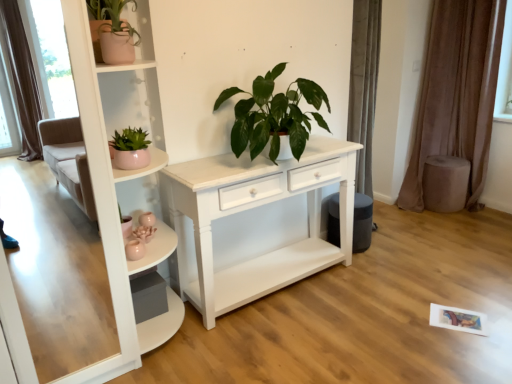
The image size is (512, 384). I want to click on matte pink pot at left, which is the 2th houseplant from left to right, so click(x=130, y=149).

This screenshot has height=384, width=512. What do you see at coordinates (457, 93) in the screenshot?
I see `brown velvet curtain at right` at bounding box center [457, 93].

Locate an element on the screen. This screenshot has height=384, width=512. green glossy plant at center, marked as the first houseplant in a right-to-left arrangement is located at coordinates pos(274,115).

Choose the correct answer: Is white glossy shelf at upper left inside matte pink pot at left, the 2th houseplant viewed from the right, or outside it?

white glossy shelf at upper left is located beyond the bounds of matte pink pot at left, the 2th houseplant viewed from the right.

From the white glossy shelf at upper left, count 1st houseplant to the right and point to it. Please provide its 2D coordinates.

[(130, 149)]

From a real-world perspective, which is physically above, white glossy shelf at upper left or matte pink pot at left, which is the 2th houseplant from left to right?

In real-world perspective, matte pink pot at left, which is the 2th houseplant from left to right, is above.

Measure the distance from white glossy shelf at upper left to matte pink pot at left, the 2th houseplant viewed from the right.

The distance of white glossy shelf at upper left from matte pink pot at left, the 2th houseplant viewed from the right, is 12.35 inches.

Locate an element on the screen. This screenshot has height=384, width=512. houseplant lying on the left of matte pink pot at left, which is the 2th houseplant from left to right is located at coordinates 112,32.

Between pink ceramic pot at upper left, the first houseplant positioned from the left, and matte pink pot at left, the 2th houseplant viewed from the right, which one appears on the right side from the viewer's perspective?

Positioned to the right is matte pink pot at left, the 2th houseplant viewed from the right.

Which point is more distant from viewer, [126,27] or [132,135]?

Positioned behind is point [132,135].

Does pink ceramic pot at upper left, which ranks as the 3th houseplant in right-to-left order, have a greater width compared to matte pink pot at left, the 2th houseplant viewed from the right?

Yes, pink ceramic pot at upper left, which ranks as the 3th houseplant in right-to-left order, is wider than matte pink pot at left, the 2th houseplant viewed from the right.

From the image's perspective, between matte pink pot at left, the 2th houseplant viewed from the right, and pink ceramic pot at upper left, which ranks as the 3th houseplant in right-to-left order, who is located below?

matte pink pot at left, the 2th houseplant viewed from the right.

Is matte pink pot at left, the 2th houseplant viewed from the right, in contact with pink ceramic pot at upper left, the first houseplant positioned from the left?

No, matte pink pot at left, the 2th houseplant viewed from the right, is not touching pink ceramic pot at upper left, the first houseplant positioned from the left.

Can you tell me how much matte pink pot at left, which is the 2th houseplant from left to right, and pink ceramic pot at upper left, the first houseplant positioned from the left, differ in facing direction?

There is a 11.9-degree angle between the facing directions of matte pink pot at left, which is the 2th houseplant from left to right, and pink ceramic pot at upper left, the first houseplant positioned from the left.

Is point (139, 159) closer or farther from the camera than point (104, 56)?

Clearly, point (139, 159) is more distant from the camera than point (104, 56).

Measure the distance from brown velvet curtain at right to white glossy shelf at upper left.

brown velvet curtain at right and white glossy shelf at upper left are 2.72 meters apart.

Is brown velvet curtain at right shorter than white glossy shelf at upper left?

Incorrect, the height of brown velvet curtain at right does not fall short of that of white glossy shelf at upper left.

Is brown velvet curtain at right turned away from white glossy shelf at upper left?

brown velvet curtain at right does not have its back to white glossy shelf at upper left.

From the image's perspective, between brown velvet curtain at right and white glossy shelf at upper left, who is located below?

white glossy shelf at upper left, from the image's perspective.

Which is more to the right, brown velvet curtain at right or matte pink pot at left, the 2th houseplant viewed from the right?

From the viewer's perspective, brown velvet curtain at right appears more on the right side.

Looking at the image, does brown velvet curtain at right seem bigger or smaller compared to matte pink pot at left, which is the 2th houseplant from left to right?

Clearly, brown velvet curtain at right is larger in size than matte pink pot at left, which is the 2th houseplant from left to right.

From the image's perspective, between brown velvet curtain at right and matte pink pot at left, the 2th houseplant viewed from the right, which one is located above?

brown velvet curtain at right is shown above in the image.

Which object is positioned more to the left, matte pink pot at left, the 2th houseplant viewed from the right, or green glossy plant at center, marked as the first houseplant in a right-to-left arrangement?

matte pink pot at left, the 2th houseplant viewed from the right, is more to the left.

Does point (113, 141) come closer to viewer compared to point (223, 95)?

That is True.

Considering the relative sizes of green glossy plant at center, acting as the third houseplant starting from the left, and white glossy shelf at upper left in the image provided, is green glossy plant at center, acting as the third houseplant starting from the left, thinner than white glossy shelf at upper left?

Indeed, green glossy plant at center, acting as the third houseplant starting from the left, has a lesser width compared to white glossy shelf at upper left.

From the image's perspective, who appears lower, green glossy plant at center, acting as the third houseplant starting from the left, or white glossy shelf at upper left?

From the image's view, white glossy shelf at upper left is below.

Which is in front, point (327, 128) or point (110, 190)?

The point (110, 190) is closer to the camera.

Which is in front, green glossy plant at center, marked as the first houseplant in a right-to-left arrangement, or white glossy shelf at upper left?

white glossy shelf at upper left is in front.

Identify the location of shelf that appears in front of the matte pink pot at left, which is the 2th houseplant from left to right. The width and height of the screenshot is (512, 384). (112, 197).

Identify the location of the 1st houseplant behind the matte pink pot at left, which is the 2th houseplant from left to right. This screenshot has width=512, height=384. (112, 32).

Which object lies nearer to the anchor point pink ceramic pot at upper left, the first houseplant positioned from the left, white glossy shelf at upper left or matte pink pot at left, the 2th houseplant viewed from the right?

Based on the image, white glossy shelf at upper left appears to be nearer to pink ceramic pot at upper left, the first houseplant positioned from the left.

Looking at the image, which one is located closer to brown velvet curtain at right, pink ceramic pot at upper left, the first houseplant positioned from the left, or matte pink pot at left, the 2th houseplant viewed from the right?

Based on the image, matte pink pot at left, the 2th houseplant viewed from the right, appears to be nearer to brown velvet curtain at right.

Looking at this image, which object lies further to the anchor point pink ceramic pot at upper left, which ranks as the 3th houseplant in right-to-left order, matte pink pot at left, which is the 2th houseplant from left to right, or brown velvet curtain at right?

brown velvet curtain at right is positioned further to the anchor pink ceramic pot at upper left, which ranks as the 3th houseplant in right-to-left order.

Which object lies further to the anchor point brown velvet curtain at right, matte pink pot at left, the 2th houseplant viewed from the right, or green glossy plant at center, marked as the first houseplant in a right-to-left arrangement?

matte pink pot at left, the 2th houseplant viewed from the right.

When comparing their distances from pink ceramic pot at upper left, which ranks as the 3th houseplant in right-to-left order, does green glossy plant at center, acting as the third houseplant starting from the left, or brown velvet curtain at right seem further?

brown velvet curtain at right.

Looking at the image, which one is located closer to matte pink pot at left, which is the 2th houseplant from left to right, green glossy plant at center, marked as the first houseplant in a right-to-left arrangement, or pink ceramic pot at upper left, the first houseplant positioned from the left?

The object closer to matte pink pot at left, which is the 2th houseplant from left to right, is pink ceramic pot at upper left, the first houseplant positioned from the left.

Which object lies nearer to the anchor point white glossy shelf at upper left, brown velvet curtain at right or pink ceramic pot at upper left, which ranks as the 3th houseplant in right-to-left order?

pink ceramic pot at upper left, which ranks as the 3th houseplant in right-to-left order, lies closer to white glossy shelf at upper left than the other object.

Consider the image. When comparing their distances from white glossy shelf at upper left, does green glossy plant at center, marked as the first houseplant in a right-to-left arrangement, or matte pink pot at left, the 2th houseplant viewed from the right, seem further?

green glossy plant at center, marked as the first houseplant in a right-to-left arrangement, is positioned further to the anchor white glossy shelf at upper left.

Identify the location of houseplant between pink ceramic pot at upper left, the first houseplant positioned from the left, and green glossy plant at center, acting as the third houseplant starting from the left. This screenshot has width=512, height=384. (130, 149).

Find the location of a particular element. This screenshot has width=512, height=384. houseplant located between white glossy shelf at upper left and green glossy plant at center, marked as the first houseplant in a right-to-left arrangement, in the left-right direction is located at coordinates (130, 149).

You are a GUI agent. You are given a task and a screenshot of the screen. Output one action in this format:
    pyautogui.click(x=<x>, y=<y>)
    Task: Click on the houseplant between matte pink pot at left, the 2th houseplant viewed from the right, and brown velvet curtain at right
    The image size is (512, 384).
    Given the screenshot: What is the action you would take?
    pyautogui.click(x=274, y=115)

This screenshot has width=512, height=384. I want to click on shelf between pink ceramic pot at upper left, which ranks as the 3th houseplant in right-to-left order, and green glossy plant at center, marked as the first houseplant in a right-to-left arrangement, so (x=112, y=197).